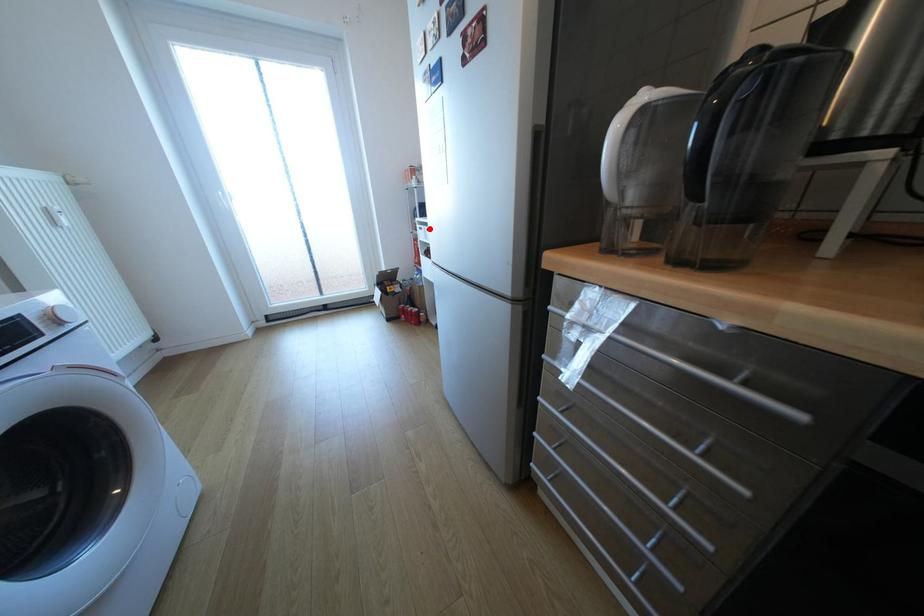
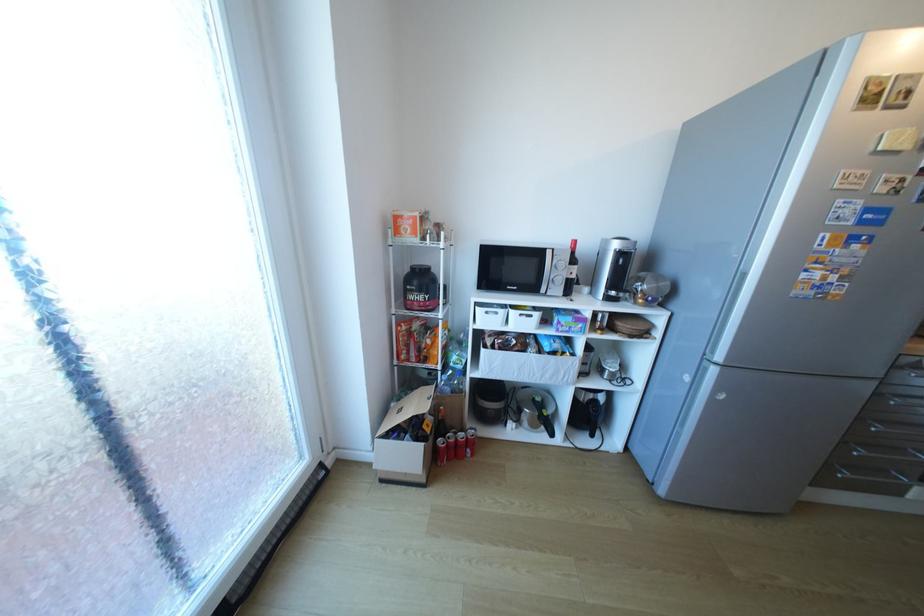
Question: I am providing you with two images of the same scene from different viewpoints. Image1 has a red point marked. In image2, the corresponding 3D location appears at what relative position? Reply with the corresponding letter.

Choices:
 (A) Closer
 (B) Farther

Answer: (B)